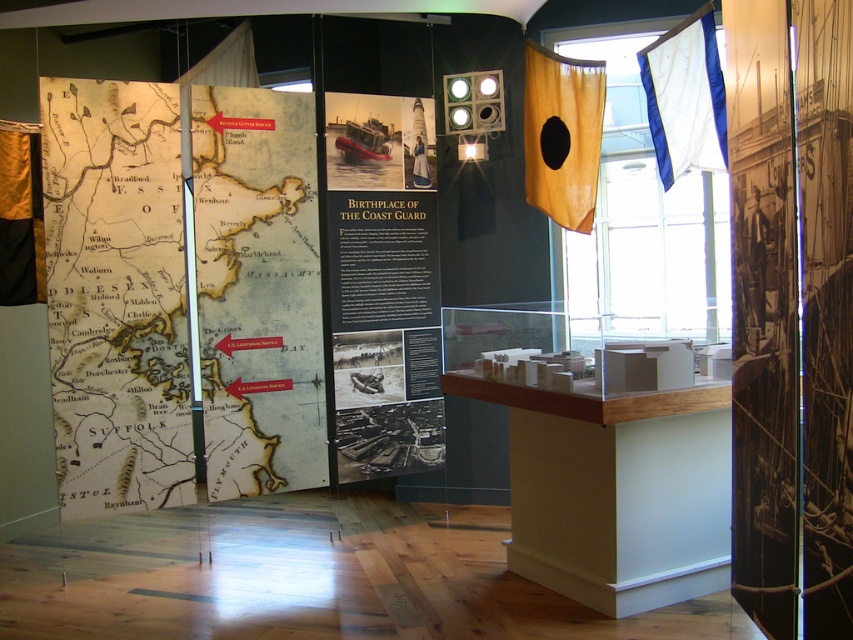
In the scene shown: Is yellow paper map at center taller than yellow fabric flag at upper right?

Yes, yellow paper map at center is taller than yellow fabric flag at upper right.

Who is higher up, yellow paper map at center or yellow fabric flag at upper right?

Positioned higher is yellow fabric flag at upper right.

Between point (200, 147) and point (543, 180), which one is positioned behind?

Positioned behind is point (543, 180).

Where is `yellow paper map at center`? This screenshot has height=640, width=853. yellow paper map at center is located at coordinates (258, 291).

Can you confirm if vintage paper map at left is bigger than yellow fabric flag at upper right?

Indeed, vintage paper map at left has a larger size compared to yellow fabric flag at upper right.

Locate an element on the screen. This screenshot has height=640, width=853. vintage paper map at left is located at coordinates (115, 296).

Where is `vintage paper map at left`? vintage paper map at left is located at coordinates (115, 296).

Who is more forward, (364,216) or (579,141)?

Point (579,141) is more forward.

This screenshot has height=640, width=853. Find the location of `matte black sign at center`. matte black sign at center is located at coordinates (383, 284).